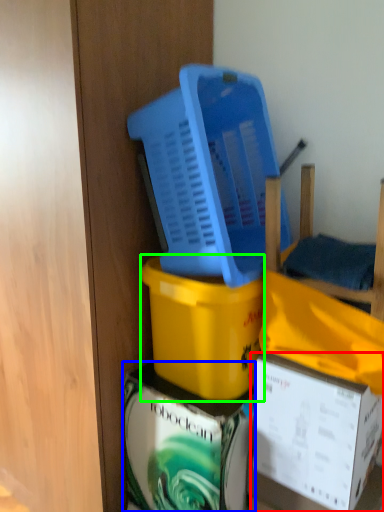
Question: Considering the real-world distances, which object is farthest from box (highlighted by a red box)? box (highlighted by a blue box) or box (highlighted by a green box)?

Choices:
 (A) box
 (B) box

Answer: (B)